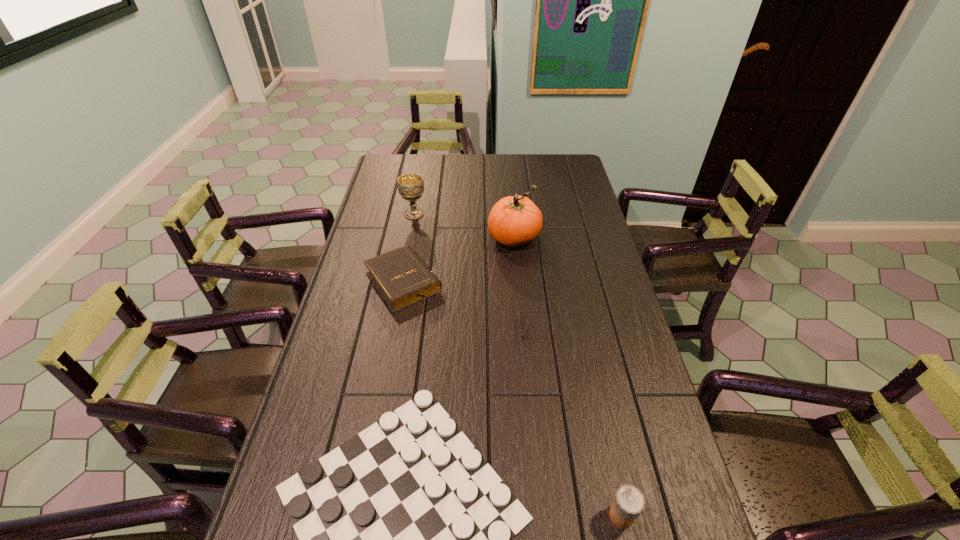
Where is `free space between the second tallest object and the tallest object`? free space between the second tallest object and the tallest object is located at coordinates (465, 226).

Locate an element on the screen. Image resolution: width=960 pixels, height=540 pixels. free space between the rightmost object and the chalice is located at coordinates coord(517,364).

Choose which object is the nearest neighbor to the farthest object. Please provide its 2D coordinates. Your answer should be formatted as a tuple, i.e. [(x, y)], where the tuple contains the x and y coordinates of a point satisfying the conditions above.

[(401, 277)]

Locate which object is the third closest to the pumpkin. Please provide its 2D coordinates. Your answer should be formatted as a tuple, i.e. [(x, y)], where the tuple contains the x and y coordinates of a point satisfying the conditions above.

[(521, 312)]